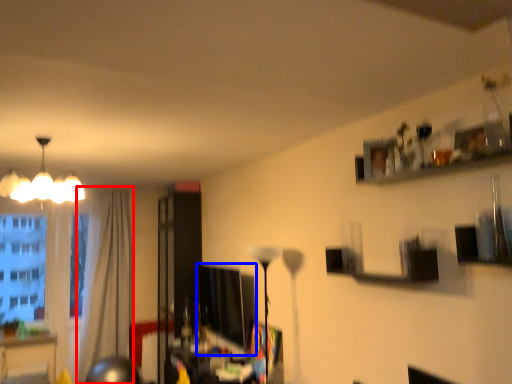
Question: Which object is closer to the camera taking this photo, curtain (highlighted by a red box) or computer monitor (highlighted by a blue box)?

Choices:
 (A) curtain
 (B) computer monitor

Answer: (B)